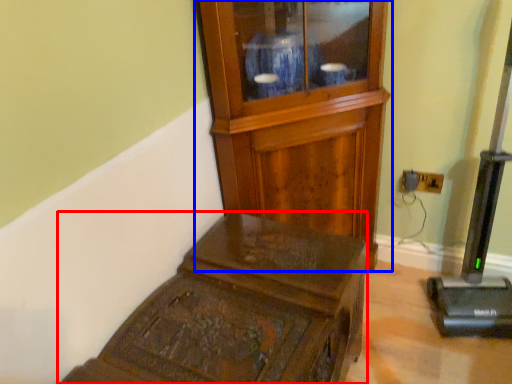
Question: Which object appears closest to the camera in this image, furniture (highlighted by a red box) or side cabinet (highlighted by a blue box)?

Choices:
 (A) furniture
 (B) side cabinet

Answer: (A)